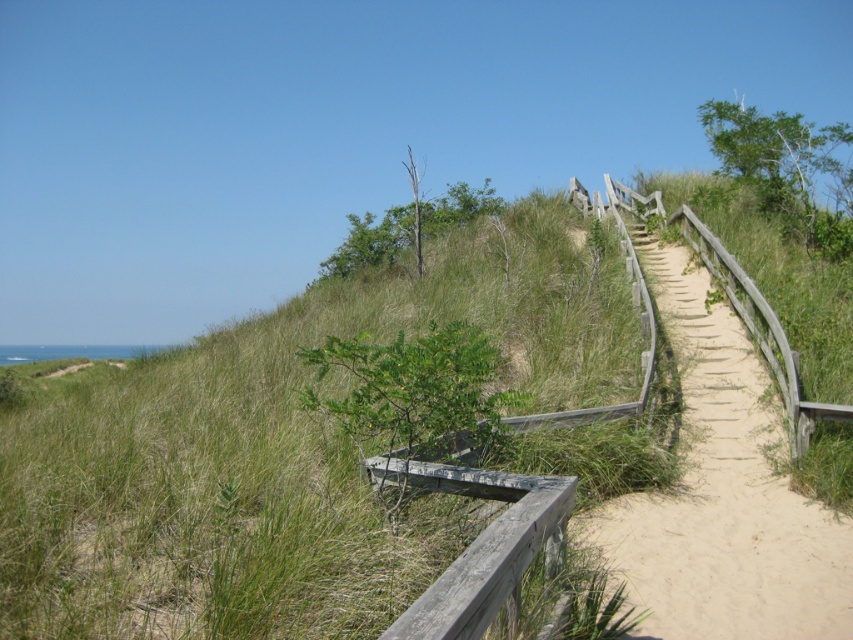
The image size is (853, 640). Describe the element at coordinates (281, 449) in the screenshot. I see `green grassy at upper center` at that location.

Can you confirm if green grassy at upper center is thinner than wooden boardwalk at upper right?

No.

Which is in front, point (268, 448) or point (773, 492)?

Positioned in front is point (268, 448).

The image size is (853, 640). Identify the location of green grassy at upper center. (281, 449).